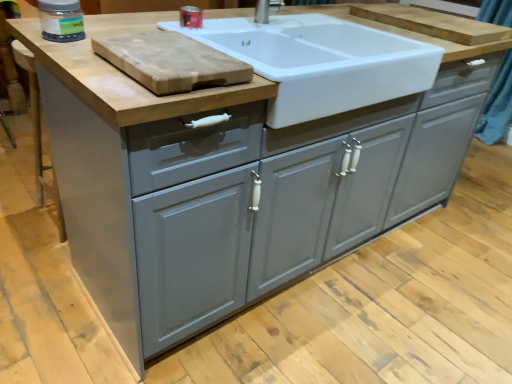
Question: Considering the relative sizes of white glossy sink at upper center and transparent plastic jar at upper left, which is counted as the 2th appliance, starting from the back, in the image provided, is white glossy sink at upper center smaller than transparent plastic jar at upper left, which is counted as the 2th appliance, starting from the back,?

Choices:
 (A) yes
 (B) no

Answer: (B)

Question: Is transparent plastic jar at upper left, the 2th appliance viewed from the right, a part of white glossy sink at upper center?

Choices:
 (A) no
 (B) yes

Answer: (A)

Question: From the image's perspective, would you say white glossy sink at upper center is shown under transparent plastic jar at upper left, which is the 1th appliance in front-to-back order?

Choices:
 (A) no
 (B) yes

Answer: (A)

Question: Is white glossy sink at upper center taller than transparent plastic jar at upper left, which is counted as the first appliance, starting from the left?

Choices:
 (A) no
 (B) yes

Answer: (B)

Question: Considering the relative sizes of white glossy sink at upper center and transparent plastic jar at upper left, which is counted as the first appliance, starting from the left, in the image provided, is white glossy sink at upper center shorter than transparent plastic jar at upper left, which is counted as the first appliance, starting from the left,?

Choices:
 (A) no
 (B) yes

Answer: (A)

Question: In the image, is transparent plastic jar at upper left, which is the 1th appliance in front-to-back order, on the left side or the right side of matte plastic container at upper center, the second appliance positioned from the front?

Choices:
 (A) left
 (B) right

Answer: (A)

Question: Considering the positions of transparent plastic jar at upper left, the 2th appliance viewed from the right, and matte plastic container at upper center, the second appliance viewed from the left, in the image, is transparent plastic jar at upper left, the 2th appliance viewed from the right, wider or thinner than matte plastic container at upper center, the second appliance viewed from the left,?

Choices:
 (A) thin
 (B) wide

Answer: (B)

Question: In the image, is transparent plastic jar at upper left, which is counted as the first appliance, starting from the left, positioned in front of or behind matte plastic container at upper center, the 1th appliance in the right-to-left sequence?

Choices:
 (A) front
 (B) behind

Answer: (A)

Question: Considering the positions of transparent plastic jar at upper left, which is the 1th appliance in front-to-back order, and matte plastic container at upper center, the second appliance viewed from the left, in the image, is transparent plastic jar at upper left, which is the 1th appliance in front-to-back order, bigger or smaller than matte plastic container at upper center, the second appliance viewed from the left,?

Choices:
 (A) small
 (B) big

Answer: (B)

Question: Is natural wood cutting board at upper left, the 2th cutting board from the right, in front of or behind transparent plastic jar at upper left, the 2th appliance viewed from the right, in the image?

Choices:
 (A) front
 (B) behind

Answer: (A)

Question: In terms of width, does natural wood cutting board at upper left, which ranks as the 1th cutting board in front-to-back order, look wider or thinner when compared to transparent plastic jar at upper left, which is the 1th appliance in front-to-back order?

Choices:
 (A) thin
 (B) wide

Answer: (B)

Question: Looking at the image, does natural wood cutting board at upper left, the 2th cutting board from the right, seem bigger or smaller compared to transparent plastic jar at upper left, which is counted as the 2th appliance, starting from the back?

Choices:
 (A) big
 (B) small

Answer: (A)

Question: From a real-world perspective, is natural wood cutting board at upper left, the 2th cutting board from the back, physically located above or below transparent plastic jar at upper left, which is counted as the first appliance, starting from the left?

Choices:
 (A) below
 (B) above

Answer: (A)

Question: From the image's perspective, is transparent plastic jar at upper left, which is the 1th appliance in front-to-back order, positioned above or below wooden cutting board at upper center, the 1th cutting board when ordered from back to front?

Choices:
 (A) below
 (B) above

Answer: (A)

Question: Do you think transparent plastic jar at upper left, which is counted as the first appliance, starting from the left, is within wooden cutting board at upper center, marked as the 2th cutting board in a front-to-back arrangement, or outside of it?

Choices:
 (A) inside
 (B) outside

Answer: (B)